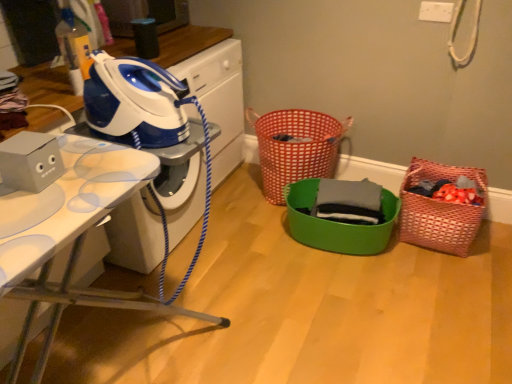
The image size is (512, 384). I want to click on free point below blue/white plastic iron at upper left, which is counted as the second appliance, starting from the front (from a real-world perspective), so click(184, 316).